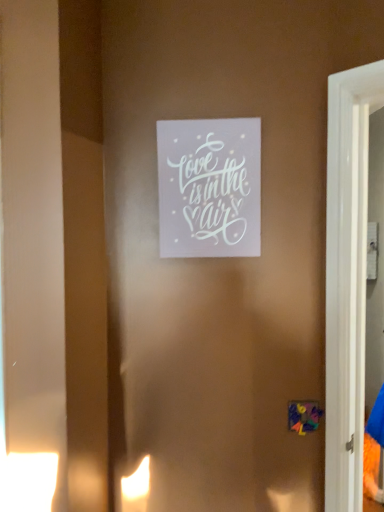
Find the location of a particular element. The width and height of the screenshot is (384, 512). white paper at center is located at coordinates (209, 187).

What is the approximate width of white paper at center?

It is 0.57 inches.

Consider the image. Measure the distance between white paper at center and camera.

white paper at center and camera are 1.22 meters apart from each other.

What do you see at coordinates (209, 187) in the screenshot? I see `white paper at center` at bounding box center [209, 187].

Identify the location of white paper at center. (209, 187).